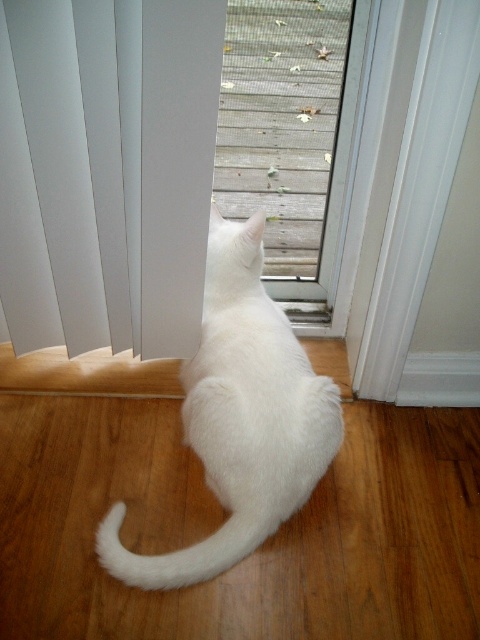
You are a visitor entering the room and see the white fluffy cat at center and the white matte blinds at center. Which object is closer to the left side of the room?

The white matte blinds at center is positioned on the left side of white fluffy cat at center, so it is closer to the left side of the room.

You are a drone operator trying to navigate a small drone through the space between the two points, point (207, 113) and point (120, 566). The drone has a height of 0.05 units. Can the drone pass through the space between them without hitting either point?

The point (207, 113) is in front of point (120, 566). Since the drone has a height of 0.05 units, it can navigate between them as long as the vertical distance between the points allows clearance. However, the description only specifies their spatial relationship in terms of front and back, not vertical clearance. Without information on vertical distance, we cannot confirm if the drone can pass safely.

You are a photographer trying to capture the white fluffy cat at center and the white fluffy tail at lower center in the same frame. Which object should you position your camera closer to in order to include both in the shot?

You should position your camera closer to the white fluffy tail at lower center because the white fluffy cat at center is to the right of it, so moving closer to the tail would help frame both objects within the shot.